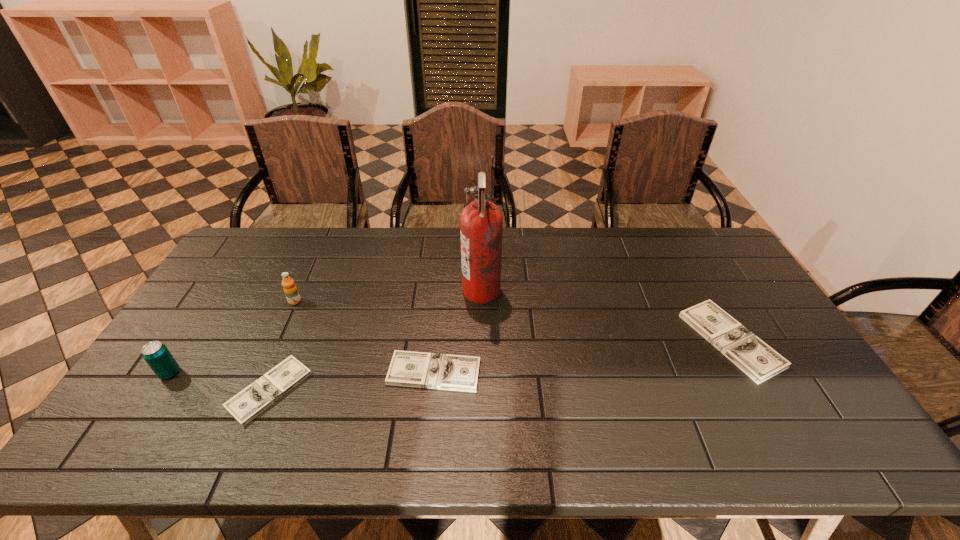
Locate an element on the screen. The height and width of the screenshot is (540, 960). free region located 0.100m on the left of the rightmost dollar is located at coordinates (655, 340).

This screenshot has width=960, height=540. Find the location of `vacant space situated on the label of the orange juice`. vacant space situated on the label of the orange juice is located at coordinates (258, 382).

You are a GUI agent. You are given a task and a screenshot of the screen. Output one action in this format:
    pyautogui.click(x=<x>, y=<y>)
    Task: Click on the vacant region located 0.200m on the back of the beer can
    The height and width of the screenshot is (540, 960).
    Given the screenshot: What is the action you would take?
    pyautogui.click(x=209, y=312)

Identify the location of blank area located on the front of the tallest object near the operation label. (352, 291).

I want to click on vacant region located on the front of the tallest object near the operation label, so click(x=359, y=291).

Image resolution: width=960 pixels, height=540 pixels. I want to click on free region located 0.360m on the front of the tallest object near the operation label, so click(x=349, y=291).

I want to click on object positioned at the left edge, so click(x=158, y=357).

What are the coordinates of `object that is at the right edge` in the screenshot? It's located at (759, 361).

This screenshot has width=960, height=540. In the image, there is a desktop. Find the location of `free space at the far edge`. free space at the far edge is located at coordinates (660, 239).

In the image, there is a desktop. Identify the location of free region at the near edge. The width and height of the screenshot is (960, 540). (312, 391).